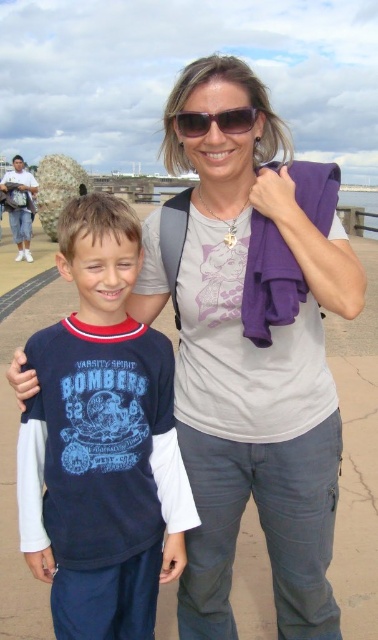
Does matte blue t-shirt at center have a smaller size compared to sunglasses at upper center?

Actually, matte blue t-shirt at center might be larger than sunglasses at upper center.

I want to click on matte blue t-shirt at center, so click(x=105, y=435).